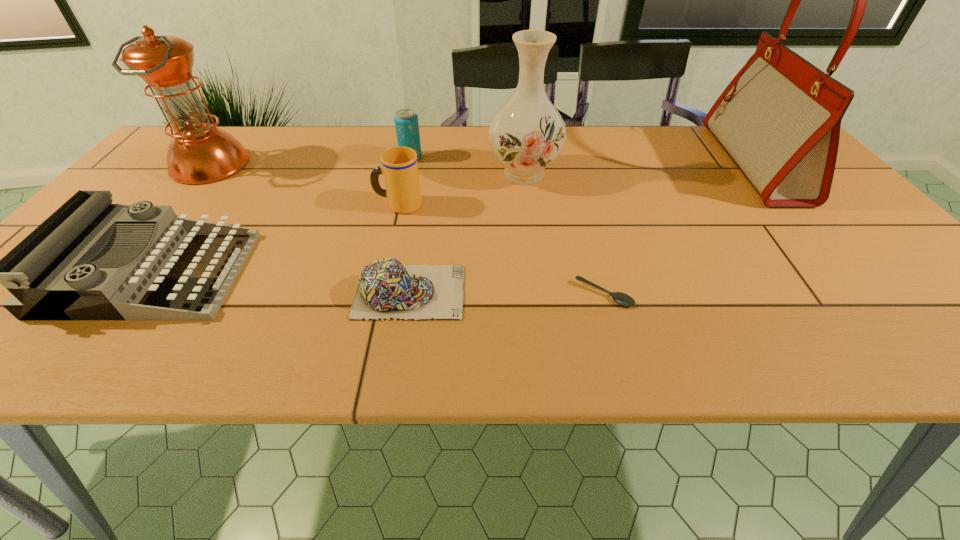
Identify the location of free location located on the right of the oil lamp. The height and width of the screenshot is (540, 960). (305, 165).

Where is `vacant space located on the left of the vase`? vacant space located on the left of the vase is located at coordinates (413, 174).

Identify the location of blank area located 0.150m on the side of the cup with the handle. The image size is (960, 540). (314, 205).

Where is `vacant region located 0.290m on the side of the cup with the handle`? The width and height of the screenshot is (960, 540). vacant region located 0.290m on the side of the cup with the handle is located at coordinates (256, 205).

Identify the location of free space located 0.120m on the side of the cup with the handle. The image size is (960, 540). (326, 205).

Identify the location of free space located on the right of the soda can. [461, 157].

In order to click on free space located 0.190m on the typing side of the typewriter in this screenshot , I will do `click(331, 274)`.

The height and width of the screenshot is (540, 960). Find the location of `free location located on the front, side, and top of the cap`. free location located on the front, side, and top of the cap is located at coordinates (510, 292).

Find the location of a particular element. This screenshot has width=960, height=540. free region located 0.280m on the back of the soupspoon is located at coordinates (579, 200).

The height and width of the screenshot is (540, 960). I want to click on handbag that is positioned at the far edge, so click(x=779, y=119).